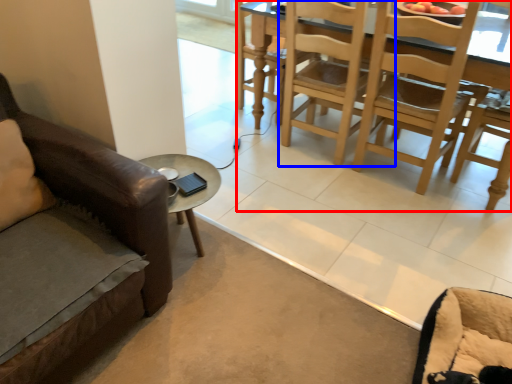
Question: Which object is further to the camera taking this photo, kitchen & dining room table (highlighted by a red box) or chair (highlighted by a blue box)?

Choices:
 (A) kitchen & dining room table
 (B) chair

Answer: (B)